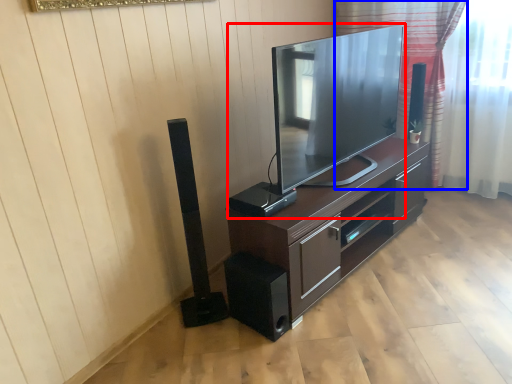
Question: Which point is closer to the camera, television (highlighted by a red box) or curtain (highlighted by a blue box)?

Choices:
 (A) television
 (B) curtain

Answer: (A)